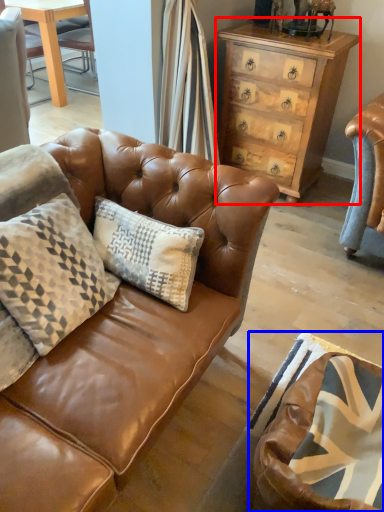
Question: Which object appears closest to the camera in this image, chest of drawers (highlighted by a red box) or swivel chair (highlighted by a blue box)?

Choices:
 (A) chest of drawers
 (B) swivel chair

Answer: (B)